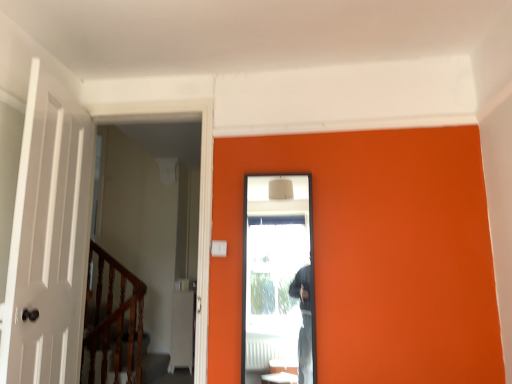
Question: Is wooden polished rail at left bigger than clear glass screen door at center?

Choices:
 (A) yes
 (B) no

Answer: (A)

Question: From the image's perspective, is wooden polished rail at left over clear glass screen door at center?

Choices:
 (A) yes
 (B) no

Answer: (B)

Question: Does wooden polished rail at left have a greater height compared to clear glass screen door at center?

Choices:
 (A) yes
 (B) no

Answer: (A)

Question: Is wooden polished rail at left aimed at clear glass screen door at center?

Choices:
 (A) yes
 (B) no

Answer: (B)

Question: From a real-world perspective, does wooden polished rail at left sit lower than clear glass screen door at center?

Choices:
 (A) no
 (B) yes

Answer: (B)

Question: Can you confirm if wooden polished rail at left is smaller than clear glass screen door at center?

Choices:
 (A) yes
 (B) no

Answer: (B)

Question: Is clear glass screen door at center not near wooden polished rail at left?

Choices:
 (A) no
 (B) yes

Answer: (B)

Question: Is clear glass screen door at center located outside wooden polished rail at left?

Choices:
 (A) yes
 (B) no

Answer: (A)

Question: Is clear glass screen door at center facing towards wooden polished rail at left?

Choices:
 (A) no
 (B) yes

Answer: (A)

Question: Is wooden polished rail at left at the back of clear glass screen door at center?

Choices:
 (A) yes
 (B) no

Answer: (B)

Question: From a real-world perspective, is clear glass screen door at center under wooden polished rail at left?

Choices:
 (A) no
 (B) yes

Answer: (A)

Question: Can you confirm if clear glass screen door at center is positioned to the right of wooden polished rail at left?

Choices:
 (A) no
 (B) yes

Answer: (B)

Question: Does point (297, 175) appear closer or farther from the camera than point (92, 336)?

Choices:
 (A) farther
 (B) closer

Answer: (B)